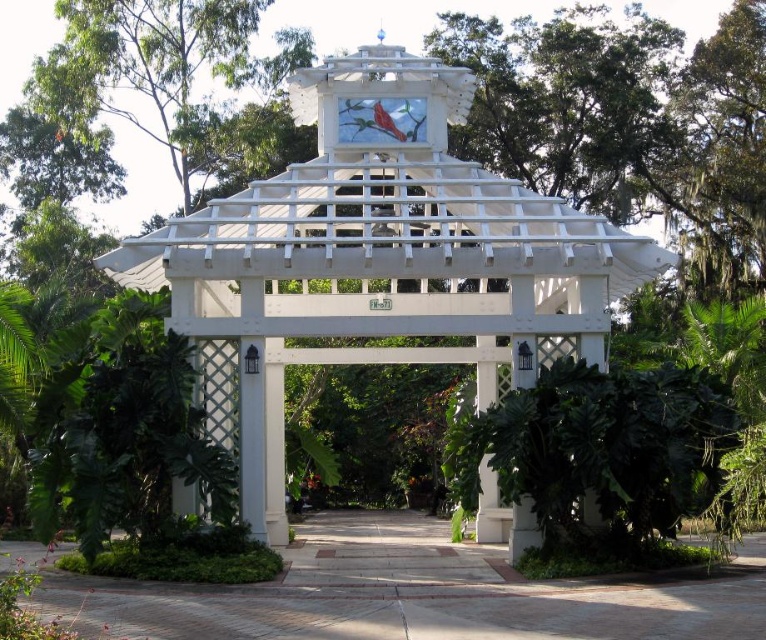
Question: Does white lattice gazebo at center appear over paved stone path at center?

Choices:
 (A) no
 (B) yes

Answer: (B)

Question: Is white lattice gazebo at center to the right of paved stone path at center from the viewer's perspective?

Choices:
 (A) no
 (B) yes

Answer: (B)

Question: Which point is closer to the camera?

Choices:
 (A) (483, 570)
 (B) (257, 390)

Answer: (A)

Question: Which object is closer to the camera taking this photo?

Choices:
 (A) white lattice gazebo at center
 (B) paved stone path at center

Answer: (B)

Question: Which of the following is the farthest from the observer?

Choices:
 (A) (296, 269)
 (B) (503, 564)

Answer: (A)

Question: Is the position of white lattice gazebo at center more distant than that of paved stone path at center?

Choices:
 (A) no
 (B) yes

Answer: (B)